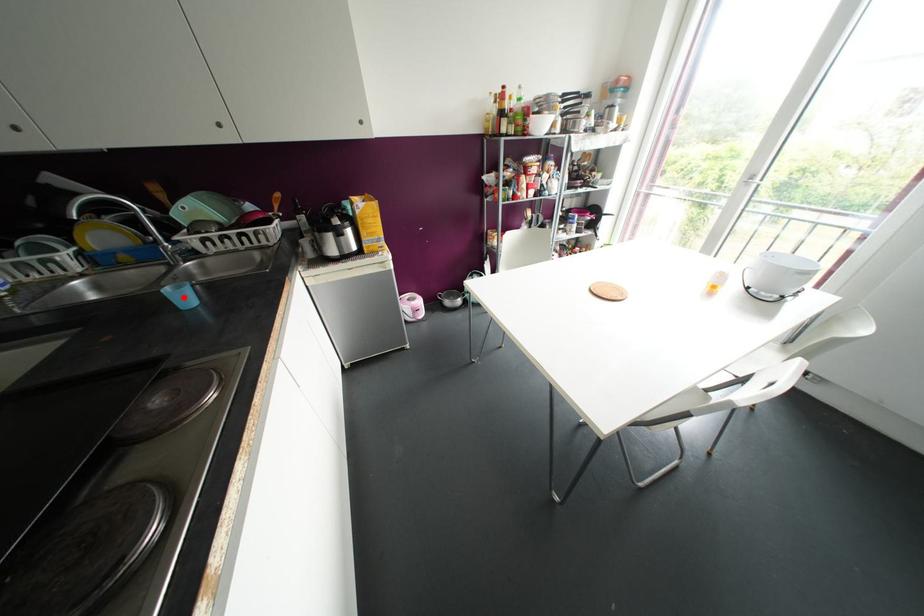
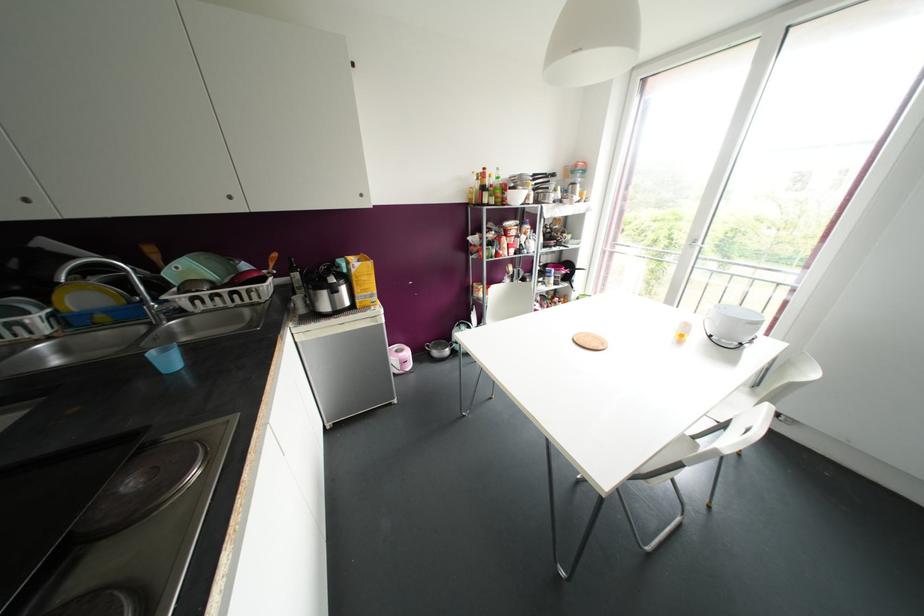
Find the pixel in the second image that matches the highlighted location in the first image.

(168, 361)